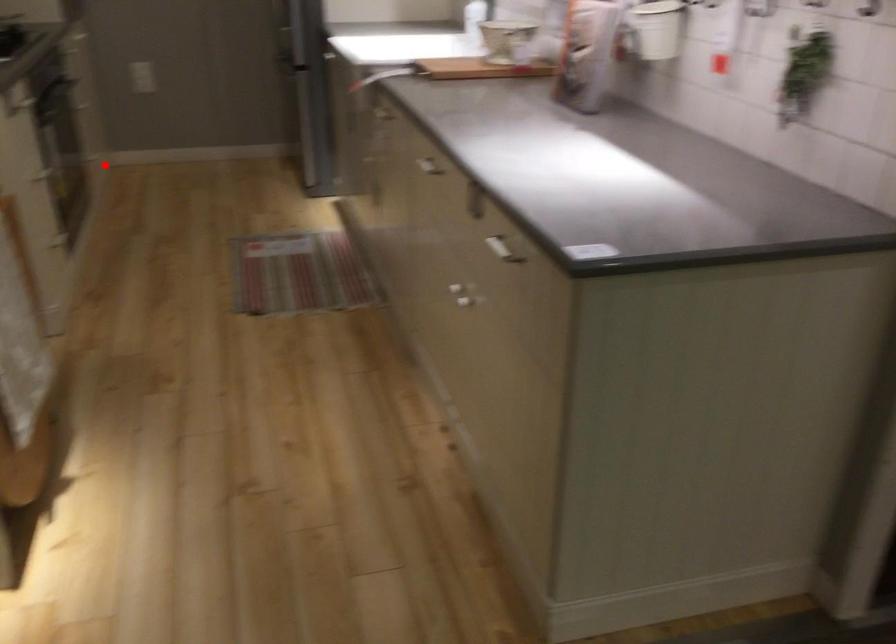
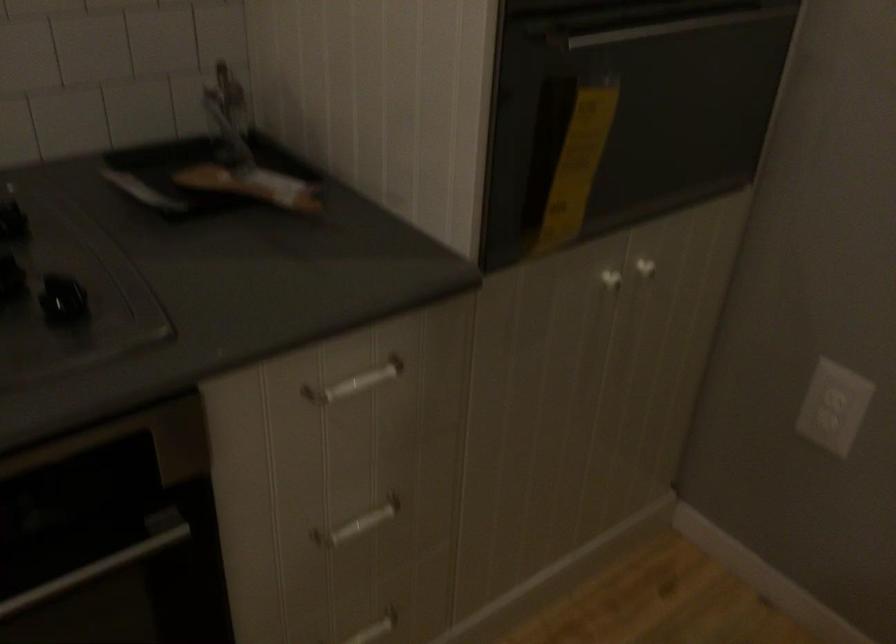
The point at the highlighted location is marked in the first image. Where is the corresponding point in the second image?

(374, 629)